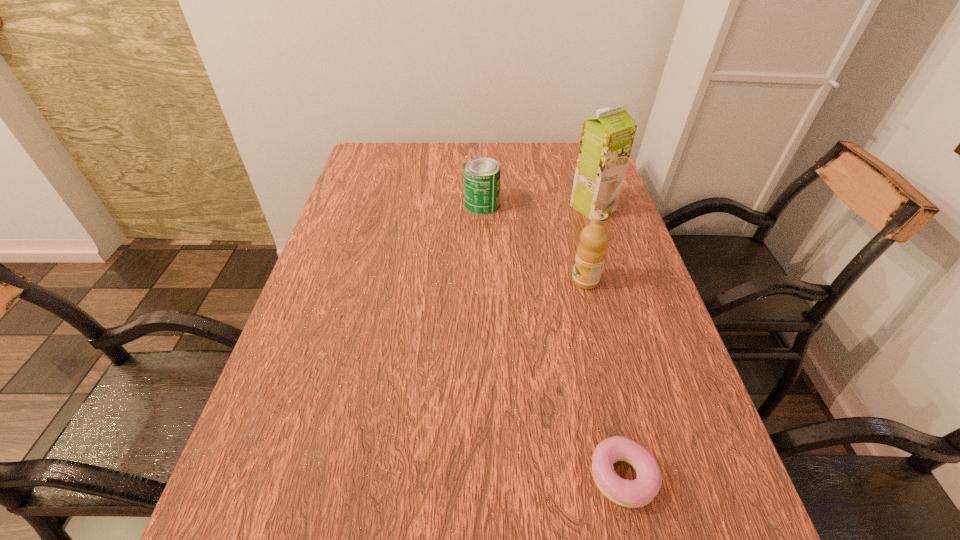
Identify the location of vacant space at the far right corner of the desktop. This screenshot has height=540, width=960. (566, 147).

Image resolution: width=960 pixels, height=540 pixels. I want to click on free space between the third tallest object and the second nearest object, so coord(534,243).

Locate an element on the screen. Image resolution: width=960 pixels, height=540 pixels. free space between the shortest object and the tallest object is located at coordinates (608, 342).

You are a GUI agent. You are given a task and a screenshot of the screen. Output one action in this format:
    pyautogui.click(x=<x>, y=<y>)
    Task: Click on the vacant region between the leftmost object and the second tallest object
    
    Given the screenshot: What is the action you would take?
    pyautogui.click(x=534, y=243)

Find the location of a particular element. This screenshot has width=960, height=540. empty location between the can and the nearest object is located at coordinates tap(552, 340).

Find the location of a particular element. This screenshot has height=540, width=960. free space between the leftmost object and the soya milk is located at coordinates (538, 206).

This screenshot has width=960, height=540. Identify the location of free point between the doughnut and the second shortest object. (552, 340).

Where is `free point between the second nearest object and the nearest object`? free point between the second nearest object and the nearest object is located at coordinates (604, 379).

Where is `free space between the shortest object and the can`? This screenshot has height=540, width=960. free space between the shortest object and the can is located at coordinates (552, 340).

You are a GUI agent. You are given a task and a screenshot of the screen. Output one action in this format:
    pyautogui.click(x=<x>, y=<y>)
    Task: Click on the object that is the third closest to the second tallest object
    This screenshot has width=960, height=540.
    Given the screenshot: What is the action you would take?
    pyautogui.click(x=636, y=493)